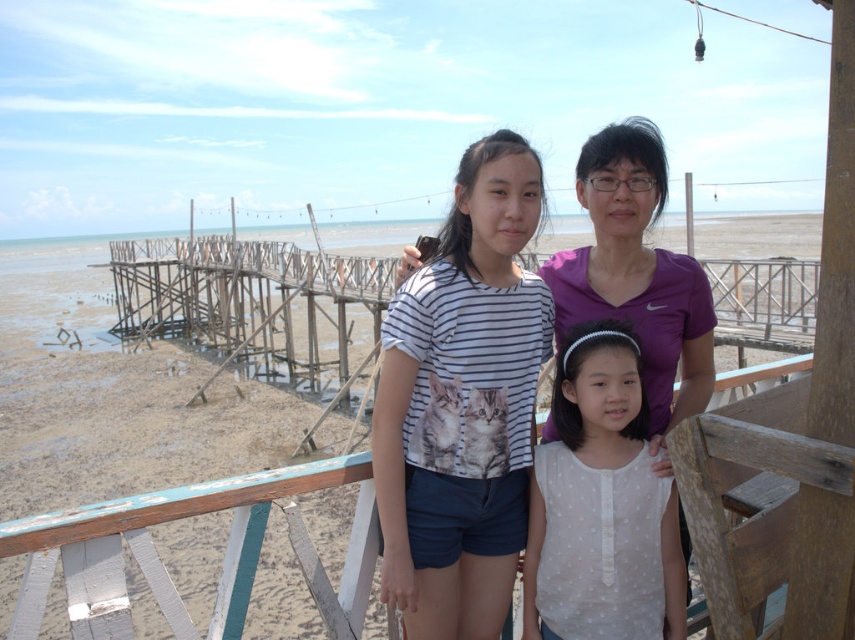
You are a photographer trying to capture a photo of the white striped shirt at center and the purple matte shirt at center. Since they are both at the center, which one is closer to the camera?

The white striped shirt at center is positioned under the purple matte shirt at center, so the white striped shirt at center is closer to the camera.

You are a photographer trying to capture a group photo of the two subjects wearing the white striped shirt at center and the white dotted blouse at center. Since you want to ensure both are visible in the frame, which clothing item should you focus on to ensure proper framing?

The white striped shirt at center is taller than the white dotted blouse at center, so focusing on the white striped shirt at center will help ensure both are visible in the frame.

You are standing on the wooden walkway at the beachside and see two points marked in the image. Which point, point (461, 288) or point (658, 166), is closer to you?

Point (461, 288) is closer to the viewer than point (658, 166).